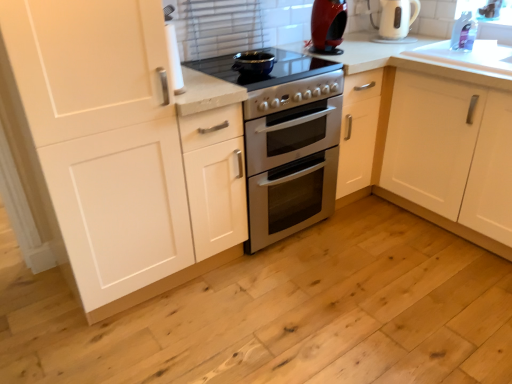
Describe the element at coordinates (396, 21) in the screenshot. I see `white glossy electric kettle at upper right` at that location.

The height and width of the screenshot is (384, 512). I want to click on white glossy electric kettle at upper right, so click(x=396, y=21).

What do you see at coordinates (287, 142) in the screenshot? I see `white glossy oven at center, marked as the 2th appliance in a top-to-bottom arrangement` at bounding box center [287, 142].

What is the approximate height of shiny red coffee machine at upper center?

It is 11.25 inches.

This screenshot has height=384, width=512. In order to click on matte black pot at center, arranged as the first appliance when viewed from the top in this screenshot , I will do `click(254, 63)`.

Measure the distance between point (x=459, y=15) and camera.

Point (x=459, y=15) and camera are 2.35 meters apart.

Locate an element on the screen. Image resolution: width=512 pixels, height=384 pixels. white glossy electric kettle at upper right is located at coordinates (396, 21).

Are white glossy electric kettle at upper right and matte black pot at center, marked as the 2th appliance in a bottom-to-top arrangement, making contact?

No, white glossy electric kettle at upper right is not making contact with matte black pot at center, marked as the 2th appliance in a bottom-to-top arrangement.

From the image's perspective, is white glossy electric kettle at upper right beneath matte black pot at center, arranged as the first appliance when viewed from the top?

Actually, white glossy electric kettle at upper right appears above matte black pot at center, arranged as the first appliance when viewed from the top, in the image.

Is the position of white glossy electric kettle at upper right less distant than that of matte black pot at center, arranged as the first appliance when viewed from the top?

No, it is not.

How distant is white glossy electric kettle at upper right from matte black pot at center, arranged as the first appliance when viewed from the top?

A distance of 37.79 inches exists between white glossy electric kettle at upper right and matte black pot at center, arranged as the first appliance when viewed from the top.

Considering the positions of objects white matte cabinet at left and white glossy oven at center, acting as the first appliance starting from the bottom, in the image provided, who is behind, white matte cabinet at left or white glossy oven at center, acting as the first appliance starting from the bottom,?

white glossy oven at center, acting as the first appliance starting from the bottom, is further from the camera.

From the image's perspective, does white matte cabinet at left appear higher than white glossy oven at center, acting as the first appliance starting from the bottom?

No, from the image's perspective, white matte cabinet at left is not on top of white glossy oven at center, acting as the first appliance starting from the bottom.

Which is correct: white matte cabinet at left is inside white glossy oven at center, marked as the 2th appliance in a top-to-bottom arrangement, or outside of it?

white matte cabinet at left is not inside white glossy oven at center, marked as the 2th appliance in a top-to-bottom arrangement, it's outside.

Can you confirm if white matte cabinet at left is wider than white glossy oven at center, marked as the 2th appliance in a top-to-bottom arrangement?

No, white matte cabinet at left is not wider than white glossy oven at center, marked as the 2th appliance in a top-to-bottom arrangement.

Which is closer, (490, 161) or (91, 173)?

The point (91, 173) is in front.

Is white glossy countertop at upper right next to white matte cabinet at left?

They are not placed beside each other.

Find the location of a particular element. The height and width of the screenshot is (384, 512). cabinetry on the left side of white glossy countertop at upper right is located at coordinates (124, 149).

How different are the orientations of transparent plastic window screen at upper right and white glossy electric kettle at upper right in degrees?

87.8 degrees.

Can you confirm if transparent plastic window screen at upper right is thinner than white glossy electric kettle at upper right?

Yes, transparent plastic window screen at upper right is thinner than white glossy electric kettle at upper right.

Between transparent plastic window screen at upper right and white glossy electric kettle at upper right, which one is positioned behind?

white glossy electric kettle at upper right.

Does point (319, 45) lie in front of point (508, 9)?

No, (319, 45) is behind (508, 9).

What are the coordinates of `kitchen appliance in front of the transparent plastic window screen at upper right` in the screenshot? It's located at (328, 26).

Can you tell me how much shiny red coffee machine at upper center and transparent plastic window screen at upper right differ in facing direction?

The angular difference between shiny red coffee machine at upper center and transparent plastic window screen at upper right is 87.8 degrees.

Is shiny red coffee machine at upper center oriented away from transparent plastic window screen at upper right?

shiny red coffee machine at upper center does not have its back to transparent plastic window screen at upper right.

Between shiny red coffee machine at upper center and white glossy electric kettle at upper right, which one has smaller size?

shiny red coffee machine at upper center.

Is shiny red coffee machine at upper center wider or thinner than white glossy electric kettle at upper right?

Clearly, shiny red coffee machine at upper center has less width compared to white glossy electric kettle at upper right.

Is shiny red coffee machine at upper center taller or shorter than white glossy electric kettle at upper right?

shiny red coffee machine at upper center is taller than white glossy electric kettle at upper right.

Is shiny red coffee machine at upper center completely or partially outside of white glossy electric kettle at upper right?

Absolutely, shiny red coffee machine at upper center is external to white glossy electric kettle at upper right.

Can you confirm if matte black pot at center, marked as the 2th appliance in a bottom-to-top arrangement, is positioned to the left of transparent plastic window screen at upper right?

Indeed, matte black pot at center, marked as the 2th appliance in a bottom-to-top arrangement, is positioned on the left side of transparent plastic window screen at upper right.

Is matte black pot at center, marked as the 2th appliance in a bottom-to-top arrangement, bigger than transparent plastic window screen at upper right?

No, matte black pot at center, marked as the 2th appliance in a bottom-to-top arrangement, is not bigger than transparent plastic window screen at upper right.

Locate an element on the screen. The width and height of the screenshot is (512, 384). coffeepot behind the matte black pot at center, arranged as the first appliance when viewed from the top is located at coordinates (396, 21).

In order to click on appliance below the white matte cabinet at left (from a real-world perspective) in this screenshot , I will do `click(287, 142)`.

Which object lies nearer to the anchor point white glossy countertop at upper right, matte black pot at center, arranged as the first appliance when viewed from the top, or white matte cabinet at left?

The object closer to white glossy countertop at upper right is matte black pot at center, arranged as the first appliance when viewed from the top.

Consider the image. When comparing their distances from matte black pot at center, marked as the 2th appliance in a bottom-to-top arrangement, does white glossy electric kettle at upper right or transparent plastic window screen at upper right seem closer?

white glossy electric kettle at upper right is positioned closer to the anchor matte black pot at center, marked as the 2th appliance in a bottom-to-top arrangement.

From the image, which object appears to be farther from white matte cabinet at left, transparent plastic window screen at upper right or shiny red coffee machine at upper center?

transparent plastic window screen at upper right lies further to white matte cabinet at left than the other object.

Estimate the real-world distances between objects in this image. Which object is closer to transparent plastic window screen at upper right, white glossy oven at center, marked as the 2th appliance in a top-to-bottom arrangement, or white glossy electric kettle at upper right?

white glossy electric kettle at upper right lies closer to transparent plastic window screen at upper right than the other object.

Looking at the image, which one is located further to white glossy countertop at upper right, white glossy oven at center, acting as the first appliance starting from the bottom, or shiny red coffee machine at upper center?

Among the two, shiny red coffee machine at upper center is located further to white glossy countertop at upper right.

From the picture: Considering their positions, is white glossy countertop at upper right positioned closer to white matte cabinet at left than white glossy oven at center, acting as the first appliance starting from the bottom?

white glossy oven at center, acting as the first appliance starting from the bottom, is closer to white matte cabinet at left.

From the image, which object appears to be farther from white matte cabinet at left, white glossy countertop at upper right or white glossy electric kettle at upper right?

white glossy electric kettle at upper right.

From the image, which object appears to be nearer to transparent plastic window screen at upper right, white glossy countertop at upper right or shiny red coffee machine at upper center?

The object closer to transparent plastic window screen at upper right is white glossy countertop at upper right.

You are a GUI agent. You are given a task and a screenshot of the screen. Output one action in this format:
    pyautogui.click(x=<x>, y=<y>)
    Task: Click on the countertop between shiny red coffee machine at upper center and transparent plastic window screen at upper right in the horizontal direction
    The height and width of the screenshot is (384, 512).
    Given the screenshot: What is the action you would take?
    pyautogui.click(x=430, y=137)

At what (x,y) coordinates should I click in order to perform the action: click on coffeepot between shiny red coffee machine at upper center and transparent plastic window screen at upper right from left to right. Please return your answer as a coordinate pair (x, y). This screenshot has width=512, height=384. Looking at the image, I should click on (396, 21).

What are the coordinates of `kitchen appliance between white matte cabinet at left and transparent plastic window screen at upper right in the horizontal direction` in the screenshot? It's located at (328, 26).

In order to click on coffeepot located between matte black pot at center, arranged as the first appliance when viewed from the top, and white glossy countertop at upper right in the left-right direction in this screenshot , I will do `click(396, 21)`.